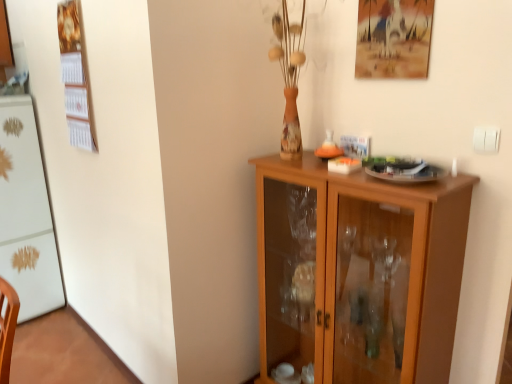
Find the location of a particular element. This screenshot has width=512, height=384. vacant point above wooden cabinet at center (from a real-world perspective) is located at coordinates (351, 162).